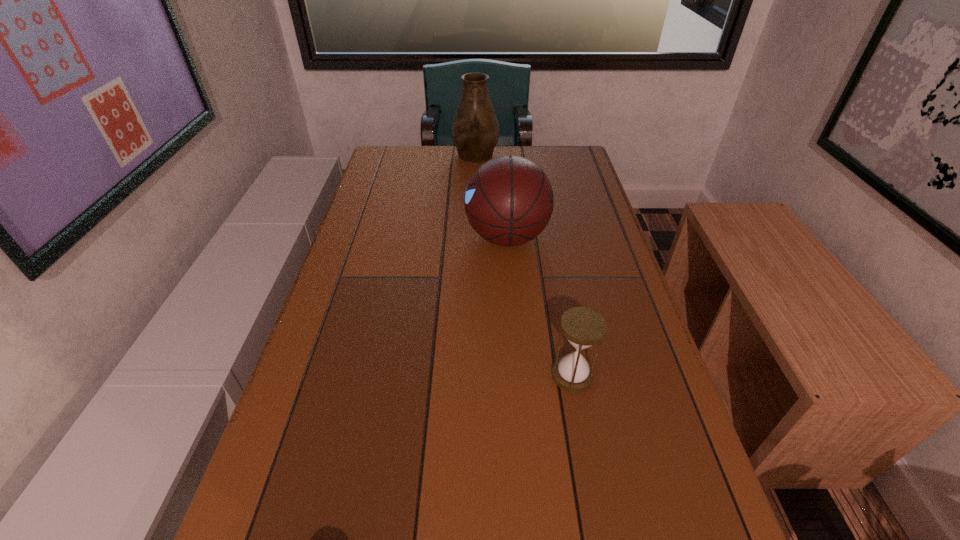
Locate an element on the screen. object that is the second nearest to the second tallest object is located at coordinates (583, 327).

You are a GUI agent. You are given a task and a screenshot of the screen. Output one action in this format:
    pyautogui.click(x=<x>, y=<y>)
    Task: Click on the free space that satisfies the following two spatial constraints: 1. on the handle side of the farthest object; 2. on the left side of the second tallest object
    This screenshot has width=960, height=540.
    Given the screenshot: What is the action you would take?
    pyautogui.click(x=474, y=237)

Where is `free location that satisfies the following two spatial constraints: 1. on the handle side of the pitcher; 2. on the right side of the second tallest object`? free location that satisfies the following two spatial constraints: 1. on the handle side of the pitcher; 2. on the right side of the second tallest object is located at coordinates (474, 237).

The width and height of the screenshot is (960, 540). Identify the location of vacant region that satisfies the following two spatial constraints: 1. on the handle side of the tallest object; 2. on the left side of the shortest object. (472, 375).

The image size is (960, 540). Identify the location of vacant space that satisfies the following two spatial constraints: 1. on the handle side of the farthest object; 2. on the left side of the nearest object. (472, 375).